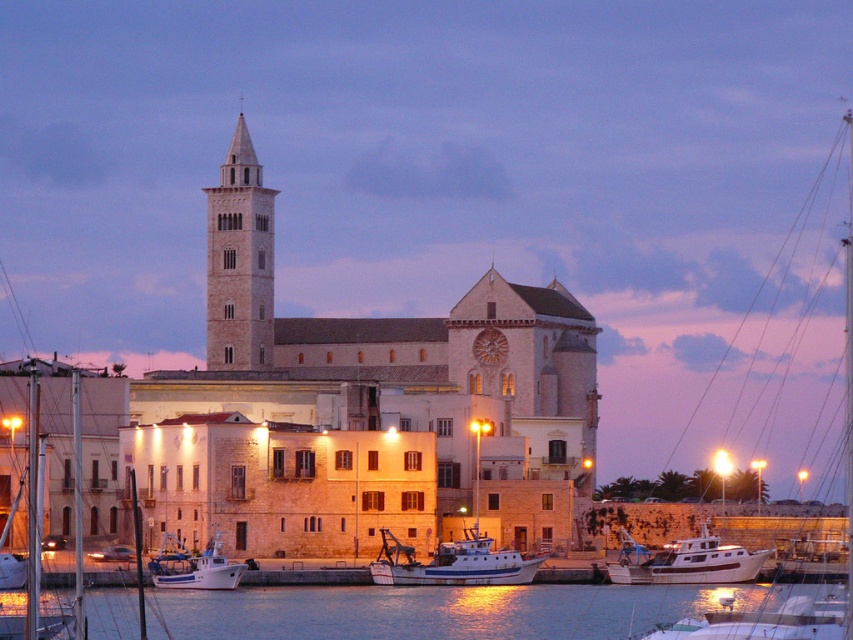
Question: Does glossy water at lower center have a smaller size compared to white matte boat at lower left?

Choices:
 (A) yes
 (B) no

Answer: (B)

Question: Is glossy water at lower center bigger than light beige stone bell tower at center?

Choices:
 (A) no
 (B) yes

Answer: (A)

Question: Can you confirm if glossy water at lower center is thinner than white matte boat at lower right?

Choices:
 (A) yes
 (B) no

Answer: (B)

Question: Which object is farther from the camera taking this photo?

Choices:
 (A) white matte boat at lower left
 (B) white matte boat at lower right
 (C) white matte boat at center
 (D) glossy water at lower center

Answer: (B)

Question: Which object is farther from the camera taking this photo?

Choices:
 (A) glossy water at lower center
 (B) white matte boat at center
 (C) light beige stone bell tower at center
 (D) white matte boat at lower left

Answer: (C)

Question: Among these objects, which one is farthest from the camera?

Choices:
 (A) white matte boat at lower right
 (B) light beige stone bell tower at center

Answer: (B)